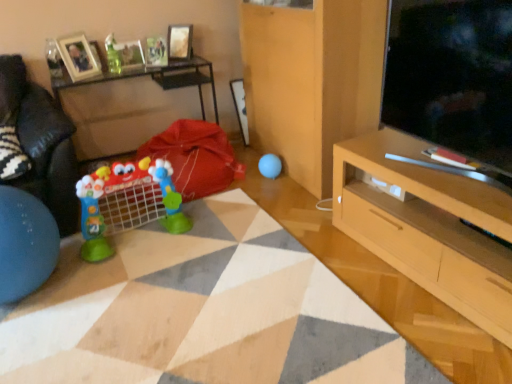
Image resolution: width=512 pixels, height=384 pixels. Find the location of `black leather couch at left`. black leather couch at left is located at coordinates (42, 143).

Locate an element on the screen. This screenshot has width=512, height=384. light wood cabinet at lower right is located at coordinates (312, 81).

What is the approximate height of light wood cabinet at lower right?

1.11 meters.

In order to face matte glass picture frame at upper left, the second picture frame in the right-to-left sequence, should I rotate leftwards or rightwards?

A 16.610 degree turn to the left will do.

What are the coordinates of `black leather couch at left` in the screenshot? It's located at click(42, 143).

Does matte black tv at right touch light wood cabinet at lower right?

No.

Which of these two, matte black tv at right or light wood cabinet at lower right, stands shorter?

Standing shorter between the two is matte black tv at right.

Which of these two, matte black tv at right or light wood cabinet at lower right, is smaller?

With smaller size is matte black tv at right.

At what (x,y) coordinates should I click in order to perform the action: click on television located below the light wood cabinet at lower right (from the image's perspective). Please return your answer as a coordinate pair (x, y). Looking at the image, I should click on (452, 76).

Which object is further away from the camera taking this photo, light wood tv stand at right or matte black tv at right?

Positioned behind is light wood tv stand at right.

Considering the relative positions of light wood tv stand at right and matte black tv at right in the image provided, is light wood tv stand at right to the right of matte black tv at right from the viewer's perspective?

Yes, light wood tv stand at right is to the right of matte black tv at right.

Considering the relative sizes of light wood tv stand at right and matte black tv at right in the image provided, is light wood tv stand at right shorter than matte black tv at right?

Yes, light wood tv stand at right is shorter than matte black tv at right.

Is matte black tv at right located within light wood tv stand at right?

No, matte black tv at right is not surrounded by light wood tv stand at right.

Who is shorter, wooden photo frame at upper left, the first picture frame positioned from the left, or matte glass picture frame at upper left, the second picture frame in the right-to-left sequence?

matte glass picture frame at upper left, the second picture frame in the right-to-left sequence, is shorter.

You are a GUI agent. You are given a task and a screenshot of the screen. Output one action in this format:
    pyautogui.click(x=<x>, y=<y>)
    Task: Click on the 1st picture frame above the wooden photo frame at upper left, arranged as the third picture frame when viewed from the right (from the image's perspective)
    The height and width of the screenshot is (384, 512).
    Given the screenshot: What is the action you would take?
    pyautogui.click(x=130, y=54)

Could you tell me if wooden photo frame at upper left, the first picture frame positioned from the left, is turned towards matte glass picture frame at upper left, the second picture frame in the right-to-left sequence?

No, wooden photo frame at upper left, the first picture frame positioned from the left, is not turned towards matte glass picture frame at upper left, the second picture frame in the right-to-left sequence.

Does wooden photo frame at upper left, arranged as the third picture frame when viewed from the right, have a larger size compared to matte glass picture frame at upper left, positioned as the 2th picture frame in left-to-right order?

Correct, wooden photo frame at upper left, arranged as the third picture frame when viewed from the right, is larger in size than matte glass picture frame at upper left, positioned as the 2th picture frame in left-to-right order.

Which object is positioned more to the left, matte glass picture frame at upper left, positioned as the 2th picture frame in left-to-right order, or black leather couch at left?

From the viewer's perspective, black leather couch at left appears more on the left side.

From a real-world perspective, relative to black leather couch at left, is matte glass picture frame at upper left, positioned as the 2th picture frame in left-to-right order, vertically above or below?

matte glass picture frame at upper left, positioned as the 2th picture frame in left-to-right order, is above black leather couch at left.

Where is `studio couch on the left side of matte glass picture frame at upper left, positioned as the 2th picture frame in left-to-right order`? The height and width of the screenshot is (384, 512). studio couch on the left side of matte glass picture frame at upper left, positioned as the 2th picture frame in left-to-right order is located at coordinates (42, 143).

Considering the positions of objects matte glass picture frame at upper left, positioned as the 2th picture frame in left-to-right order, and black leather couch at left in the image provided, who is in front, matte glass picture frame at upper left, positioned as the 2th picture frame in left-to-right order, or black leather couch at left?

black leather couch at left is closer to the camera.

Is there a large distance between metallic silver picture frame at upper center, which appears as the 1th picture frame when viewed from the right, and black fuzzy pillow at left?

That's right, there is a large distance between metallic silver picture frame at upper center, which appears as the 1th picture frame when viewed from the right, and black fuzzy pillow at left.

How different are the orientations of metallic silver picture frame at upper center, marked as the 3th picture frame in a left-to-right arrangement, and black fuzzy pillow at left in degrees?

The angle between the facing direction of metallic silver picture frame at upper center, marked as the 3th picture frame in a left-to-right arrangement, and the facing direction of black fuzzy pillow at left is 33.5 degrees.

From a real-world perspective, is metallic silver picture frame at upper center, which appears as the 1th picture frame when viewed from the right, located higher than black fuzzy pillow at left?

Yes, from a real-world perspective, metallic silver picture frame at upper center, which appears as the 1th picture frame when viewed from the right, is on top of black fuzzy pillow at left.

From the image's perspective, which one is positioned lower, metallic silver picture frame at upper center, which appears as the 1th picture frame when viewed from the right, or black fuzzy pillow at left?

From the image's view, black fuzzy pillow at left is below.

At what (x,y) coordinates should I click in order to perform the action: click on plain below the wooden table at left (from the image's perspective). Please return your answer as a coordinate pair (x, y). The height and width of the screenshot is (384, 512). Looking at the image, I should click on (202, 312).

In terms of height, does wooden floor at center look taller or shorter compared to wooden table at left?

Clearly, wooden floor at center is shorter compared to wooden table at left.

Which object is further away from the camera taking this photo, wooden floor at center or wooden table at left?

wooden table at left is behind.

How much distance is there between wooden floor at center and wooden table at left?

They are 4.64 feet apart.

From the image's perspective, starting from the black fuzzy pillow at left, which picture frame is the 2nd one above? Please provide its 2D coordinates.

[(130, 54)]

In terms of height, does black fuzzy pillow at left look taller or shorter compared to matte glass picture frame at upper left, positioned as the 2th picture frame in left-to-right order?

In the image, black fuzzy pillow at left appears to be shorter than matte glass picture frame at upper left, positioned as the 2th picture frame in left-to-right order.

Is black fuzzy pillow at left oriented towards matte glass picture frame at upper left, the second picture frame in the right-to-left sequence?

No, black fuzzy pillow at left is not facing towards matte glass picture frame at upper left, the second picture frame in the right-to-left sequence.

Is point (12, 176) positioned after point (118, 51)?

No, (12, 176) is closer to viewer.

Locate an element on the screen. The image size is (512, 384). cabinetry on the left of matte black tv at right is located at coordinates (312, 81).

I want to click on desk located below the matte black tv at right (from the image's perspective), so click(431, 232).

Looking at the image, which one is located further to matte glass picture frame at upper left, positioned as the 2th picture frame in left-to-right order, blue rubber ball at center, the 2th toy from the bottom, or wooden table at left?

The object further to matte glass picture frame at upper left, positioned as the 2th picture frame in left-to-right order, is blue rubber ball at center, the 2th toy from the bottom.

Considering their positions, is translucent glass vase at upper left, the 3th toy positioned from the right, positioned closer to black fuzzy pillow at left than wooden floor at center?

Based on the image, translucent glass vase at upper left, the 3th toy positioned from the right, appears to be nearer to black fuzzy pillow at left.

Looking at this image, looking at the image, which one is located further to blue rubber ball at center, which is counted as the 2th toy, starting from the top, wooden table at left or plastic toy at center, arranged as the 1th toy when viewed from the front?

Based on the image, wooden table at left appears to be further to blue rubber ball at center, which is counted as the 2th toy, starting from the top.

Based on their spatial positions, is black leather couch at left or light wood cabinet at lower right further from translucent glass vase at upper left, which is the first toy from left to right?

light wood cabinet at lower right is positioned further to the anchor translucent glass vase at upper left, which is the first toy from left to right.

Looking at the image, which one is located closer to metallic silver picture frame at upper center, marked as the 3th picture frame in a left-to-right arrangement, plastic toy at center, the second toy from the right, or wooden table at left?

Result: wooden table at left.

Looking at the image, which one is located further to metallic silver picture frame at upper center, which appears as the 1th picture frame when viewed from the right, light wood tv stand at right or wooden floor at center?

The object further to metallic silver picture frame at upper center, which appears as the 1th picture frame when viewed from the right, is light wood tv stand at right.

When comparing their distances from matte glass picture frame at upper left, positioned as the 2th picture frame in left-to-right order, does wooden floor at center or light wood tv stand at right seem closer?

wooden floor at center lies closer to matte glass picture frame at upper left, positioned as the 2th picture frame in left-to-right order, than the other object.

Considering their positions, is matte black tv at right positioned further to black leather couch at left than translucent glass vase at upper left, which is the first toy from left to right?

matte black tv at right is further to black leather couch at left.

Where is `studio couch located between wooden floor at center and matte glass picture frame at upper left, the second picture frame in the right-to-left sequence, in the depth direction`? studio couch located between wooden floor at center and matte glass picture frame at upper left, the second picture frame in the right-to-left sequence, in the depth direction is located at coordinates (42, 143).

Locate an element on the screen. desk between wooden floor at center and wooden table at left in the front-back direction is located at coordinates (431, 232).

Find the location of a particular element. The width and height of the screenshot is (512, 384). studio couch located between wooden floor at center and wooden photo frame at upper left, arranged as the third picture frame when viewed from the right, in the depth direction is located at coordinates click(42, 143).

Where is `table located between wooden floor at center and matte glass picture frame at upper left, positioned as the 2th picture frame in left-to-right order, in the depth direction`? The height and width of the screenshot is (384, 512). table located between wooden floor at center and matte glass picture frame at upper left, positioned as the 2th picture frame in left-to-right order, in the depth direction is located at coordinates (126, 103).